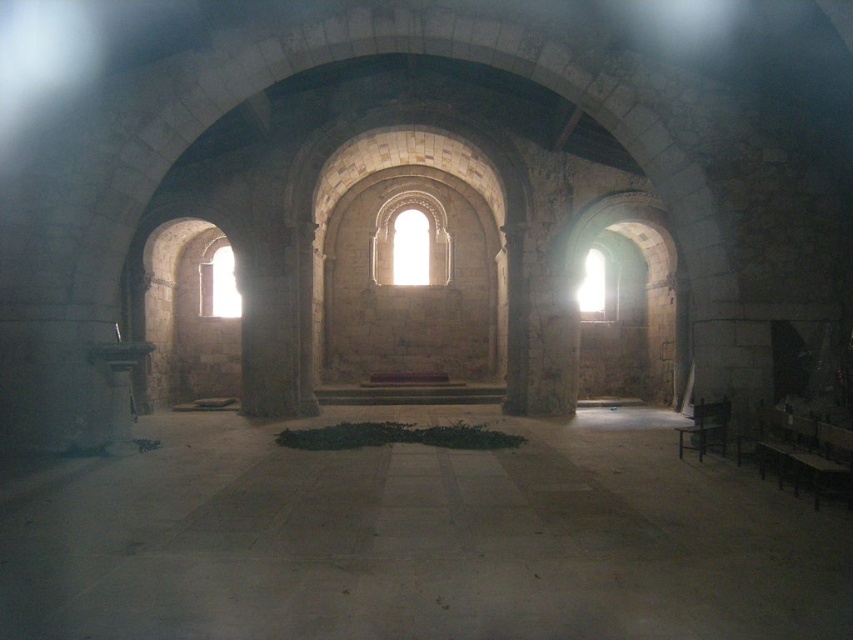
You are standing inside the church and want to walk towards the transparent glass window at left. Which direction should you move relative to the smooth stone floor at center?

The smooth stone floor at center is closer to the viewer than the transparent glass window at left, so you should move towards the left and away from the smooth stone floor at center to reach the transparent glass window at left.

You are standing in the historic stone church or cathedral shown in the image. You want to place a small potted plant exactly at the point with coordinates point (418, 540). According to the scene description, where will the potted plant be placed?

The point (418, 540) corresponds to the smooth stone floor at center, so the potted plant will be placed on the smooth stone floor at center.